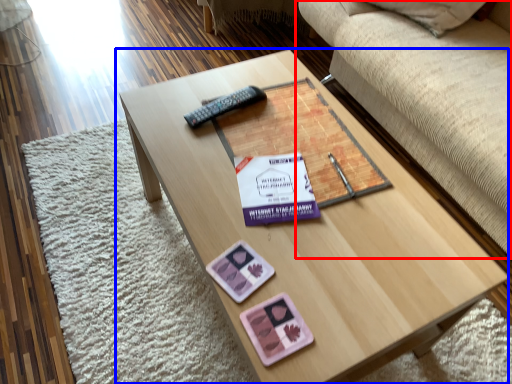
Question: Which object appears closest to the camera in this image, studio couch (highlighted by a red box) or coffee table (highlighted by a blue box)?

Choices:
 (A) studio couch
 (B) coffee table

Answer: (B)